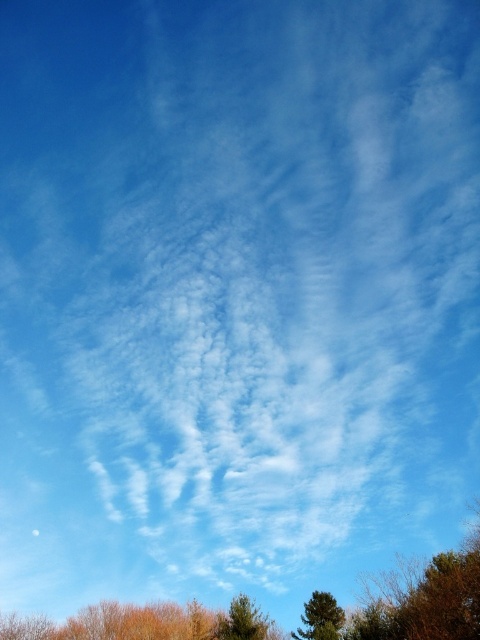
Is brown textured tree at lower center positioned before green matte tree at lower center?

Yes, it is.

Can you confirm if brown textured tree at lower center is taller than green matte tree at lower center?

Correct, brown textured tree at lower center is much taller as green matte tree at lower center.

Is point (112, 611) behind point (252, 627)?

Yes.

At what (x,y) coordinates should I click in order to perform the action: click on brown textured tree at lower center. Please return your answer as a coordinate pair (x, y). Looking at the image, I should click on (425, 600).

Between point (445, 582) and point (320, 611), which one is positioned in front?

Point (445, 582) is more forward.

Is point (451, 605) behind point (307, 628)?

No, it is in front of (307, 628).

I want to click on brown leafy tree at lower right, so click(x=428, y=600).

Does brown textured tree at lower center have a smaller size compared to green textured tree at lower center?

No.

Which is more to the left, brown textured tree at lower center or green textured tree at lower center?

Positioned to the left is brown textured tree at lower center.

Describe the element at coordinates (425, 600) in the screenshot. I see `brown textured tree at lower center` at that location.

At what (x,y) coordinates should I click in order to perform the action: click on brown textured tree at lower center. Please return your answer as a coordinate pair (x, y). The image size is (480, 640). Looking at the image, I should click on (425, 600).